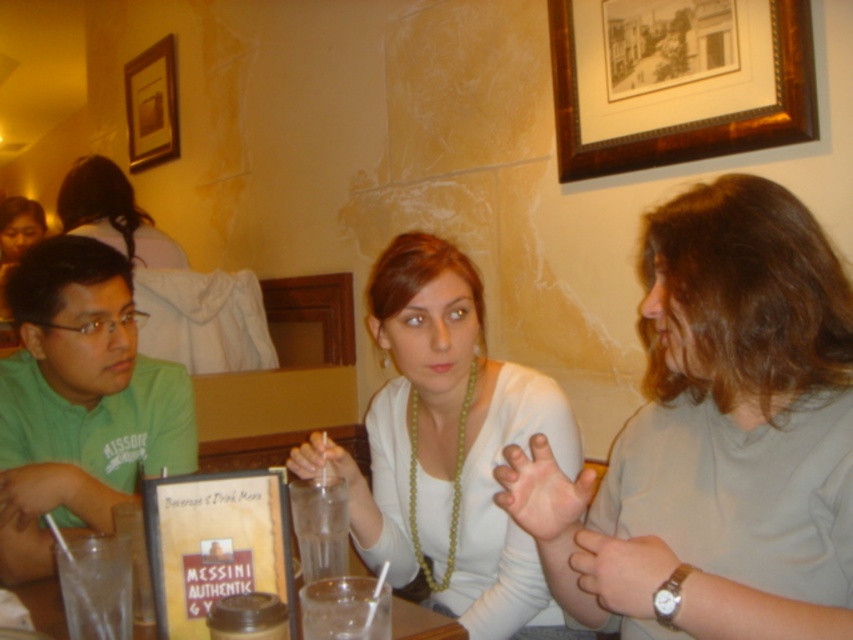
Is pale skin hand at center smaller than matte plastic fork at lower left?

Actually, pale skin hand at center might be larger than matte plastic fork at lower left.

Who is taller, pale skin hand at center or matte plastic fork at lower left?

Standing taller between the two is pale skin hand at center.

Is point (541, 540) positioned behind point (68, 467)?

That is False.

The image size is (853, 640). Find the location of `pale skin hand at center`. pale skin hand at center is located at coordinates (543, 496).

Who is more distant from viewer, [393,244] or [398,627]?

Positioned behind is point [393,244].

This screenshot has width=853, height=640. What are the coordinates of `white matte necklace at center` in the screenshot? It's located at (453, 448).

What are the coordinates of `light brown hair at center` in the screenshot? It's located at (712, 432).

Can you confirm if light brown hair at center is bigger than green matte shirt at left?

Yes.

Measure the distance between point (700, 202) and camera.

34.47 inches

At what (x,y) coordinates should I click in order to perform the action: click on light brown hair at center. Please return your answer as a coordinate pair (x, y). The image size is (853, 640). Looking at the image, I should click on (712, 432).